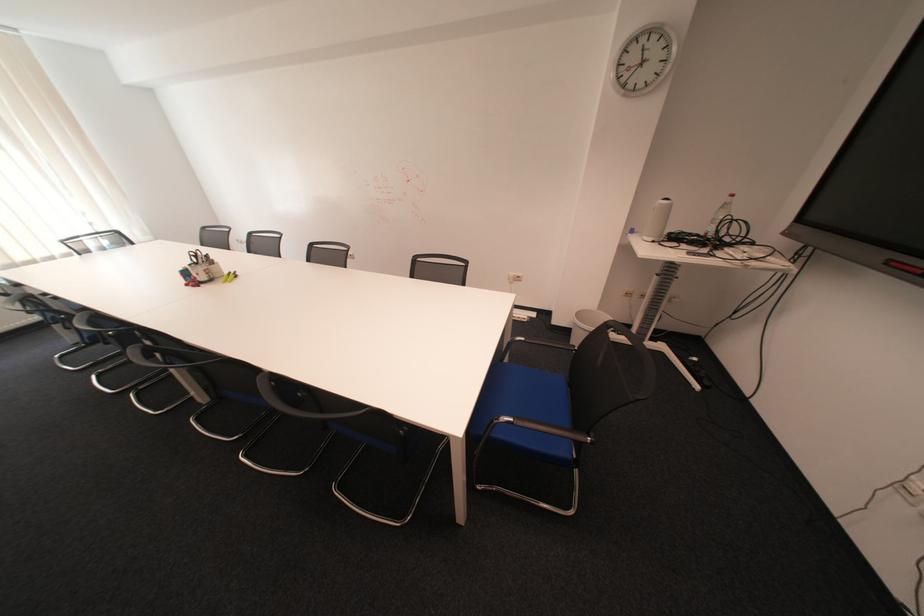
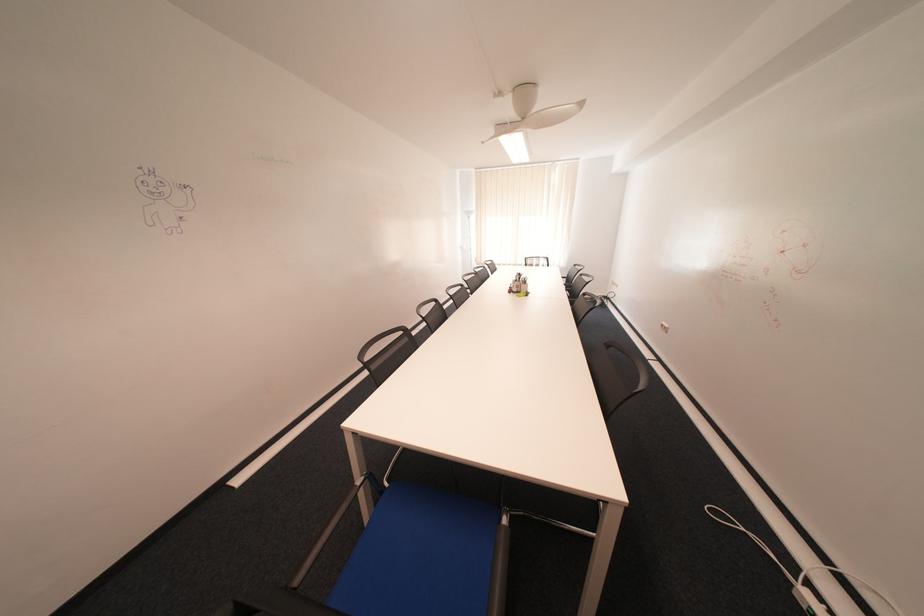
In the second image, find the point that corresponds to (x=214, y=278) in the first image.

(526, 290)